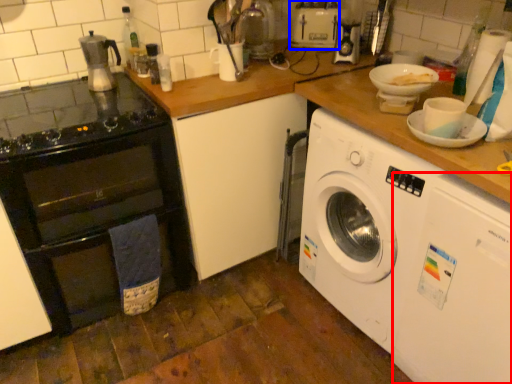
Question: Which object is further to the camera taking this photo, washing machine (highlighted by a red box) or appliance (highlighted by a blue box)?

Choices:
 (A) washing machine
 (B) appliance

Answer: (B)